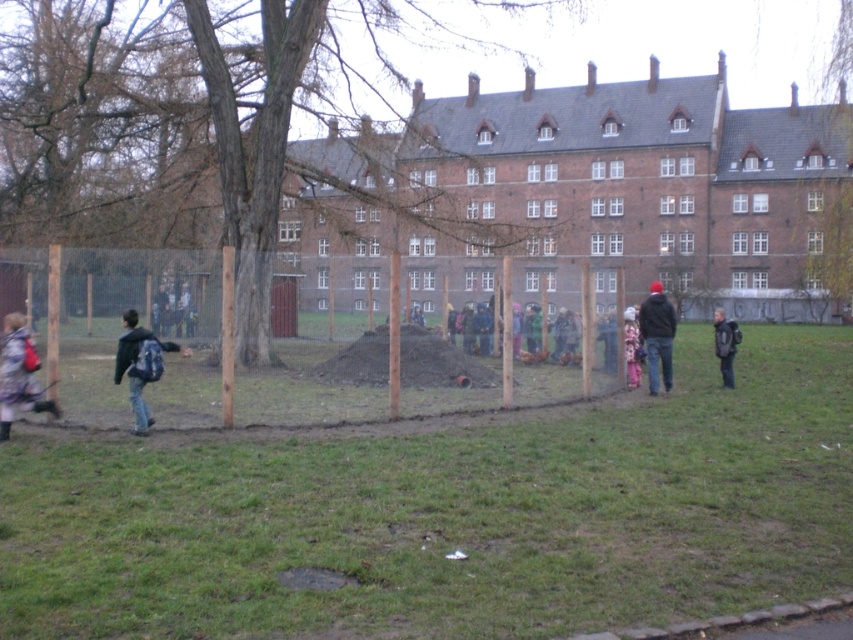
Who is shorter, matte pink backpack at lower left or matte black backpack at left?

matte pink backpack at lower left

Find the location of `matte pink backpack at lower left`. matte pink backpack at lower left is located at coordinates (19, 374).

Between point (28, 396) and point (132, 339), which one is positioned behind?

The point (132, 339) is more distant.

You are a GUI agent. You are given a task and a screenshot of the screen. Output one action in this format:
    pyautogui.click(x=<x>, y=<y>)
    Task: Click on the matte pink backpack at lower left
    
    Given the screenshot: What is the action you would take?
    pyautogui.click(x=19, y=374)

Who is more forward, (648, 298) or (722, 308)?

Point (648, 298) is in front.

Which is more to the left, dark blue jacket at center or dark gray backpack at right?

dark blue jacket at center

Which is behind, point (648, 312) or point (718, 332)?

Positioned behind is point (718, 332).

Locate an element on the screen. This screenshot has height=640, width=853. dark blue jacket at center is located at coordinates (657, 336).

Between matte black backpack at left and dark gray backpack at right, which one appears on the right side from the viewer's perspective?

dark gray backpack at right is more to the right.

Which of these two, matte black backpack at left or dark gray backpack at right, stands taller?

Standing taller between the two is dark gray backpack at right.

Find the location of a particular element. The height and width of the screenshot is (640, 853). matte black backpack at left is located at coordinates (140, 364).

You are a GUI agent. You are given a task and a screenshot of the screen. Output one action in this format:
    pyautogui.click(x=<x>, y=<y>)
    Task: Click on the matte black backpack at left
    The image size is (853, 640).
    Given the screenshot: What is the action you would take?
    pyautogui.click(x=140, y=364)